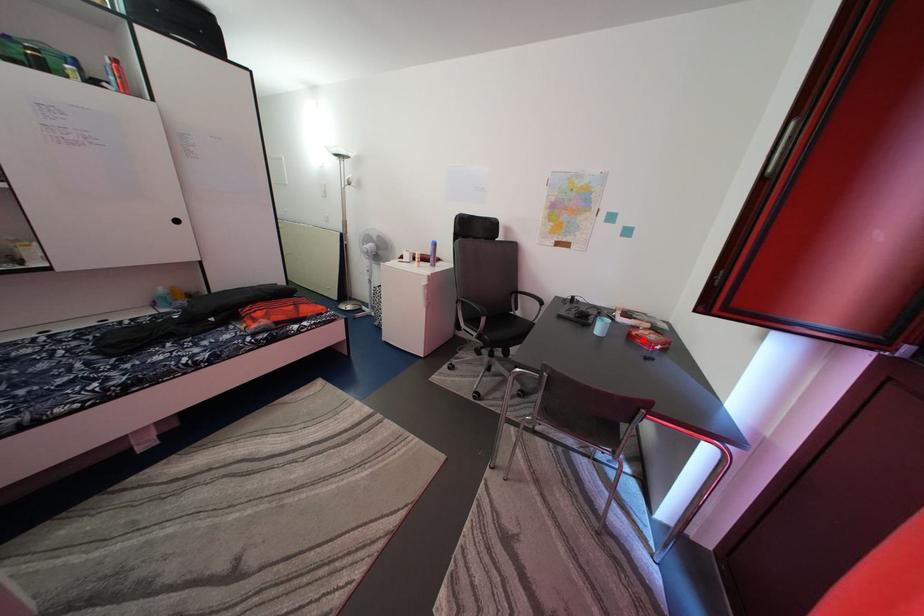
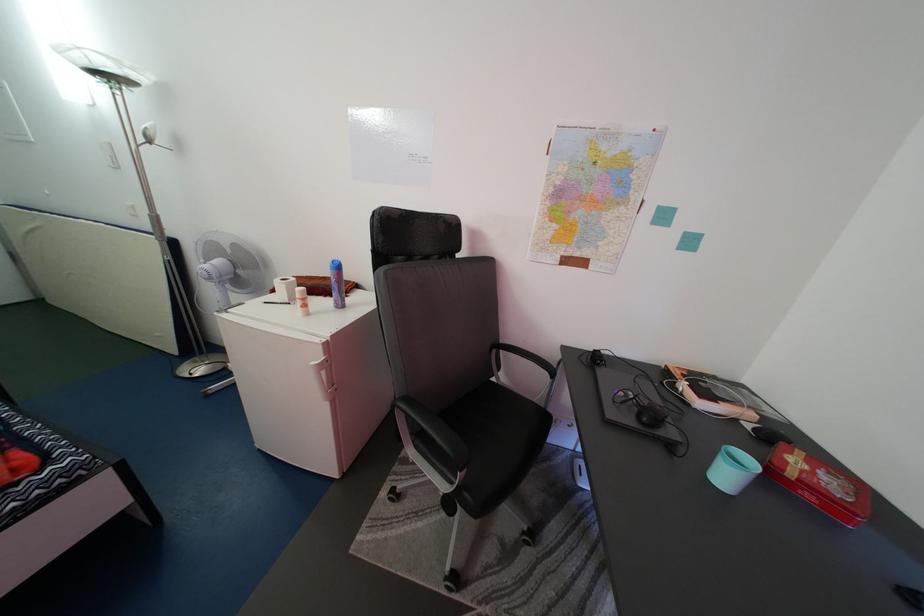
Where in the second image is the point corresponding to the highlighted location from the first image?

(799, 480)